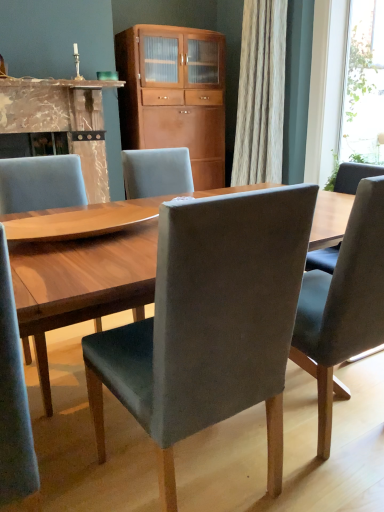
Describe the element at coordinates (174, 95) in the screenshot. The image size is (384, 512). I see `wooden cabinet at center` at that location.

What is the approximate width of velvet grey chair at center, which is the 2th chair from left to right?

velvet grey chair at center, which is the 2th chair from left to right, is 52.38 centimeters wide.

The height and width of the screenshot is (512, 384). Describe the element at coordinates (210, 323) in the screenshot. I see `velvet grey chair at center, placed as the 2th chair when sorted from right to left` at that location.

The width and height of the screenshot is (384, 512). I want to click on velvet grey chair at center, the 1th chair in the right-to-left sequence, so click(x=343, y=305).

Where is `marble fireplace at left`? Image resolution: width=384 pixels, height=512 pixels. marble fireplace at left is located at coordinates (62, 120).

Find the location of a particular element. This screenshot has height=512, width=384. window screen behind the matte gray chair at center, the 1th chair from the left is located at coordinates (364, 82).

Which object is closer to the camera taking this photo, matte gray chair at center, the 1th chair from the left, or transparent glass window at upper right?

matte gray chair at center, the 1th chair from the left, is more forward.

In terms of height, does matte gray chair at center, the third chair in the right-to-left sequence, look taller or shorter compared to transparent glass window at upper right?

matte gray chair at center, the third chair in the right-to-left sequence, is shorter than transparent glass window at upper right.

Is matte gray chair at center, the 1th chair from the left, not close to transparent glass window at upper right?

matte gray chair at center, the 1th chair from the left, is far away from transparent glass window at upper right.

Considering the sizes of objects velvet grey chair at center, placed as the 2th chair when sorted from right to left, and velvet grey chair at center, marked as the 3th chair in a left-to-right arrangement, in the image provided, who is wider, velvet grey chair at center, placed as the 2th chair when sorted from right to left, or velvet grey chair at center, marked as the 3th chair in a left-to-right arrangement,?

velvet grey chair at center, marked as the 3th chair in a left-to-right arrangement.

Does velvet grey chair at center, which is the 2th chair from left to right, have a greater height compared to velvet grey chair at center, marked as the 3th chair in a left-to-right arrangement?

Yes, velvet grey chair at center, which is the 2th chair from left to right, is taller than velvet grey chair at center, marked as the 3th chair in a left-to-right arrangement.

Between velvet grey chair at center, which is the 2th chair from left to right, and velvet grey chair at center, marked as the 3th chair in a left-to-right arrangement, which one has larger size?

velvet grey chair at center, marked as the 3th chair in a left-to-right arrangement, is bigger.

Consider the image. Is velvet grey chair at center, placed as the 2th chair when sorted from right to left, not within velvet grey chair at center, the 1th chair in the right-to-left sequence?

velvet grey chair at center, placed as the 2th chair when sorted from right to left, lies outside velvet grey chair at center, the 1th chair in the right-to-left sequence,'s area.

Is velvet grey chair at center, placed as the 2th chair when sorted from right to left, positioned far away from matte gray chair at center, the 1th chair from the left?

velvet grey chair at center, placed as the 2th chair when sorted from right to left, is positioned a significant distance from matte gray chair at center, the 1th chair from the left.

From a real-world perspective, does velvet grey chair at center, placed as the 2th chair when sorted from right to left, stand above matte gray chair at center, the third chair in the right-to-left sequence?

No, from a real-world perspective, velvet grey chair at center, placed as the 2th chair when sorted from right to left, is not above matte gray chair at center, the third chair in the right-to-left sequence.

Which object is more forward, velvet grey chair at center, placed as the 2th chair when sorted from right to left, or matte gray chair at center, the third chair in the right-to-left sequence?

velvet grey chair at center, placed as the 2th chair when sorted from right to left.

From the image's perspective, is transparent glass window at upper right positioned above or below velvet grey chair at center, placed as the 2th chair when sorted from right to left?

transparent glass window at upper right is situated higher than velvet grey chair at center, placed as the 2th chair when sorted from right to left, in the image.

Is transparent glass window at upper right beside velvet grey chair at center, which is the 2th chair from left to right?

No.

Considering the sizes of transparent glass window at upper right and velvet grey chair at center, placed as the 2th chair when sorted from right to left, in the image, is transparent glass window at upper right wider or thinner than velvet grey chair at center, placed as the 2th chair when sorted from right to left,?

In the image, transparent glass window at upper right appears to be more narrow than velvet grey chair at center, placed as the 2th chair when sorted from right to left.

Is point (353, 56) less distant than point (1, 187)?

No, (353, 56) is behind (1, 187).

Is transparent glass window at upper right completely or partially outside of matte gray chair at center, the third chair in the right-to-left sequence?

transparent glass window at upper right is positioned outside matte gray chair at center, the third chair in the right-to-left sequence.

Which is more to the right, transparent glass window at upper right or matte gray chair at center, the 1th chair from the left?

Positioned to the right is transparent glass window at upper right.

In the image, is transparent glass window at upper right positioned in front of or behind matte gray chair at center, the third chair in the right-to-left sequence?

transparent glass window at upper right is positioned farther from the viewer than matte gray chair at center, the third chair in the right-to-left sequence.

Is velvet grey chair at center, placed as the 2th chair when sorted from right to left, at the back of marble fireplace at left?

No, marble fireplace at left's orientation is not away from velvet grey chair at center, placed as the 2th chair when sorted from right to left.

Is point (89, 178) more distant than point (279, 454)?

That is True.

Is marble fireplace at left to the left or to the right of velvet grey chair at center, placed as the 2th chair when sorted from right to left, in the image?

From the image, it's evident that marble fireplace at left is to the left of velvet grey chair at center, placed as the 2th chair when sorted from right to left.

Is matte gray chair at center, the third chair in the right-to-left sequence, beside velvet grey chair at center, placed as the 2th chair when sorted from right to left?

They are not placed beside each other.

From the image's perspective, which is above, matte gray chair at center, the third chair in the right-to-left sequence, or velvet grey chair at center, which is the 2th chair from left to right?

From the image's view, matte gray chair at center, the third chair in the right-to-left sequence, is above.

Is matte gray chair at center, the 1th chair from the left, taller or shorter than velvet grey chair at center, placed as the 2th chair when sorted from right to left?

matte gray chair at center, the 1th chair from the left, is taller than velvet grey chair at center, placed as the 2th chair when sorted from right to left.

Is point (7, 172) more distant than point (268, 434)?

Yes, it is behind point (268, 434).

The width and height of the screenshot is (384, 512). Identify the location of chair that is the 1st object directly below the transparent glass window at upper right (from a real-world perspective). (41, 183).

Which chair is the 1st one when counting from the left side of the velvet grey chair at center, marked as the 3th chair in a left-to-right arrangement? Please provide its 2D coordinates.

[(210, 323)]

Considering their positions, is marble fireplace at left positioned further to velvet grey chair at center, marked as the 3th chair in a left-to-right arrangement, than transparent glass window at upper right?

transparent glass window at upper right is further to velvet grey chair at center, marked as the 3th chair in a left-to-right arrangement.

From the image, which object appears to be farther from transparent glass window at upper right, velvet grey chair at center, marked as the 3th chair in a left-to-right arrangement, or wooden cabinet at center?

velvet grey chair at center, marked as the 3th chair in a left-to-right arrangement, lies further to transparent glass window at upper right than the other object.

When comparing their distances from marble fireplace at left, does velvet grey chair at center, the 1th chair in the right-to-left sequence, or velvet grey chair at center, placed as the 2th chair when sorted from right to left, seem closer?

velvet grey chair at center, the 1th chair in the right-to-left sequence, is positioned closer to the anchor marble fireplace at left.

Which object lies further to the anchor point wooden cabinet at center, matte gray chair at center, the 1th chair from the left, or marble fireplace at left?

Based on the image, matte gray chair at center, the 1th chair from the left, appears to be further to wooden cabinet at center.

Considering their positions, is velvet grey chair at center, marked as the 3th chair in a left-to-right arrangement, positioned further to velvet grey chair at center, placed as the 2th chair when sorted from right to left, than marble fireplace at left?

The object further to velvet grey chair at center, placed as the 2th chair when sorted from right to left, is marble fireplace at left.

Considering their positions, is velvet grey chair at center, which is the 2th chair from left to right, positioned closer to wooden cabinet at center than velvet grey chair at center, the 1th chair in the right-to-left sequence?

velvet grey chair at center, the 1th chair in the right-to-left sequence, is closer to wooden cabinet at center.

In the scene shown: When comparing their distances from velvet grey chair at center, marked as the 3th chair in a left-to-right arrangement, does wooden cabinet at center or marble fireplace at left seem further?

wooden cabinet at center is positioned further to the anchor velvet grey chair at center, marked as the 3th chair in a left-to-right arrangement.

Based on their spatial positions, is marble fireplace at left or velvet grey chair at center, placed as the 2th chair when sorted from right to left, closer to matte gray chair at center, the third chair in the right-to-left sequence?

Based on the image, velvet grey chair at center, placed as the 2th chair when sorted from right to left, appears to be nearer to matte gray chair at center, the third chair in the right-to-left sequence.

The width and height of the screenshot is (384, 512). Find the location of `chair between velvet grey chair at center, marked as the 3th chair in a left-to-right arrangement, and transparent glass window at upper right, along the z-axis`. chair between velvet grey chair at center, marked as the 3th chair in a left-to-right arrangement, and transparent glass window at upper right, along the z-axis is located at coordinates (41, 183).

The height and width of the screenshot is (512, 384). What are the coordinates of `window screen between velvet grey chair at center, which is the 2th chair from left to right, and wooden cabinet at center from front to back` in the screenshot? It's located at (364, 82).

The image size is (384, 512). Identify the location of chair between velvet grey chair at center, the 1th chair in the right-to-left sequence, and marble fireplace at left, along the z-axis. (41, 183).

I want to click on fireplace positioned between velvet grey chair at center, the 1th chair in the right-to-left sequence, and wooden cabinet at center from near to far, so click(62, 120).